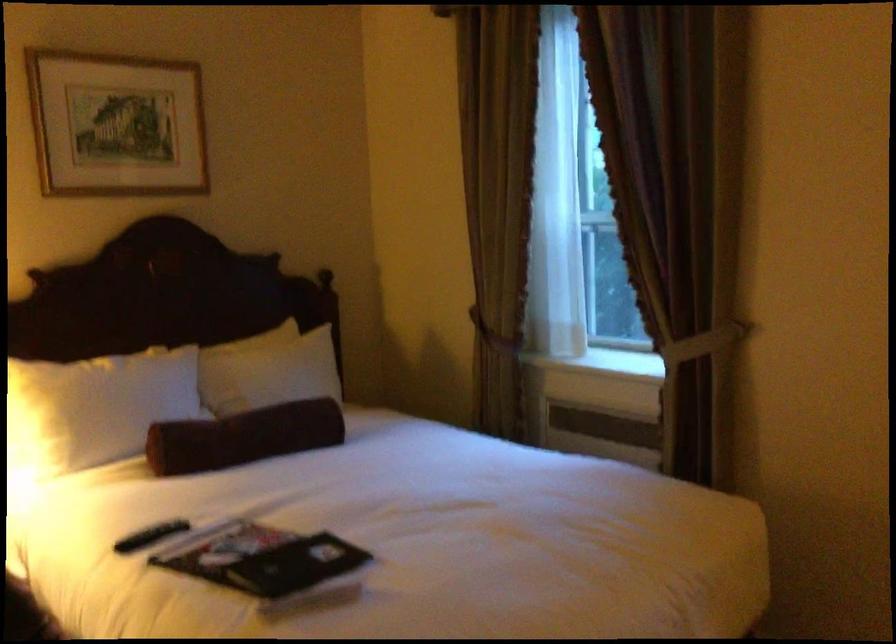
This screenshot has height=644, width=896. What are the coordinates of `brown bolster pillow` in the screenshot? It's located at (243, 437).